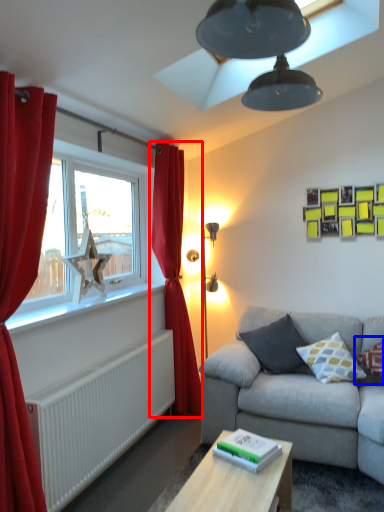
Question: Among these objects, which one is nearest to the camera, curtain (highlighted by a red box) or pillow (highlighted by a blue box)?

Choices:
 (A) curtain
 (B) pillow

Answer: (B)